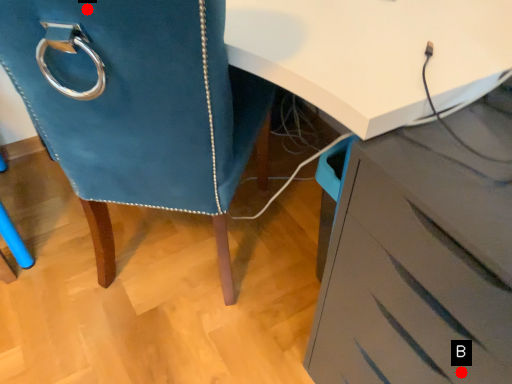
Question: Two points are circled on the image, labeled by A and B beside each circle. Which point is closer to the camera taking this photo?

Choices:
 (A) A is closer
 (B) B is closer

Answer: (A)